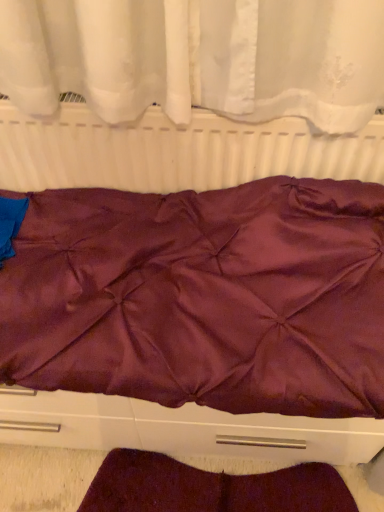
What is the approximate width of matte white radiator at center?

It is 2.42 inches.

At what (x,y) coordinates should I click in order to perform the action: click on satin purple bedspread at center. Please return your answer as a coordinate pair (x, y). The image size is (384, 512). Looking at the image, I should click on (199, 321).

Is matte white radiator at center far away from burgundy satin blanket at lower center?

matte white radiator at center is near burgundy satin blanket at lower center, not far away.

Which is behind, matte white radiator at center or burgundy satin blanket at lower center?

burgundy satin blanket at lower center is behind.

Is matte white radiator at center shorter than burgundy satin blanket at lower center?

No, matte white radiator at center is not shorter than burgundy satin blanket at lower center.

Is point (281, 162) in front of point (185, 506)?

Yes, it is.

From the image's perspective, is satin purple bedspread at center above or below matte white radiator at center?

satin purple bedspread at center is below matte white radiator at center.

Is satin purple bedspread at center oriented towards matte white radiator at center?

No.

Which object is thinner, satin purple bedspread at center or matte white radiator at center?

With smaller width is matte white radiator at center.

Considering the relative positions of satin purple bedspread at center and matte white radiator at center in the image provided, is satin purple bedspread at center to the left of matte white radiator at center from the viewer's perspective?

Yes.

Considering the sizes of objects matte white radiator at center and satin purple bedspread at center in the image provided, who is wider, matte white radiator at center or satin purple bedspread at center?

With larger width is satin purple bedspread at center.

Is matte white radiator at center turned away from satin purple bedspread at center?

matte white radiator at center is not turned away from satin purple bedspread at center.

Looking at this image, which is more to the left, matte white radiator at center or satin purple bedspread at center?

From the viewer's perspective, satin purple bedspread at center appears more on the left side.

Between matte white radiator at center and satin purple bedspread at center, which one has more height?

With more height is satin purple bedspread at center.

Which is in front, satin purple bedspread at center or burgundy satin blanket at lower center?

satin purple bedspread at center is more forward.

Would you say satin purple bedspread at center is outside burgundy satin blanket at lower center?

That's correct, satin purple bedspread at center is outside of burgundy satin blanket at lower center.

From the image's perspective, is satin purple bedspread at center under burgundy satin blanket at lower center?

No, from the image's perspective, satin purple bedspread at center is not beneath burgundy satin blanket at lower center.

At what (x,y) coordinates should I click in order to perform the action: click on blanket below the satin purple bedspread at center (from the image's perspective). Please return your answer as a coordinate pair (x, y). Image resolution: width=384 pixels, height=512 pixels. Looking at the image, I should click on (210, 487).

Which object is more forward, burgundy satin blanket at lower center or satin purple bedspread at center?

Positioned in front is satin purple bedspread at center.

Is burgundy satin blanket at lower center at the right side of satin purple bedspread at center?

Yes, burgundy satin blanket at lower center is to the right of satin purple bedspread at center.

Considering the positions of objects burgundy satin blanket at lower center and matte white radiator at center in the image provided, who is behind, burgundy satin blanket at lower center or matte white radiator at center?

Positioned behind is burgundy satin blanket at lower center.

What's the angular difference between burgundy satin blanket at lower center and matte white radiator at center's facing directions?

The angle between the facing direction of burgundy satin blanket at lower center and the facing direction of matte white radiator at center is 0.209 degrees.

Can you confirm if burgundy satin blanket at lower center is taller than matte white radiator at center?

No, burgundy satin blanket at lower center is not taller than matte white radiator at center.

From a real-world perspective, is burgundy satin blanket at lower center physically located above or below matte white radiator at center?

burgundy satin blanket at lower center is below matte white radiator at center.

Where is `blanket located underneath the matte white radiator at center (from a real-world perspective)`? blanket located underneath the matte white radiator at center (from a real-world perspective) is located at coordinates (210, 487).

The width and height of the screenshot is (384, 512). What are the coordinates of `radiator behind the satin purple bedspread at center` in the screenshot? It's located at (175, 151).

When comparing their distances from satin purple bedspread at center, does burgundy satin blanket at lower center or matte white radiator at center seem further?

Among the two, burgundy satin blanket at lower center is located further to satin purple bedspread at center.

From the image, which object appears to be farther from matte white radiator at center, burgundy satin blanket at lower center or satin purple bedspread at center?

burgundy satin blanket at lower center.

Consider the image. Based on their spatial positions, is matte white radiator at center or satin purple bedspread at center further from burgundy satin blanket at lower center?

matte white radiator at center is further to burgundy satin blanket at lower center.

From the image, which object appears to be nearer to burgundy satin blanket at lower center, satin purple bedspread at center or matte white radiator at center?

Based on the image, satin purple bedspread at center appears to be nearer to burgundy satin blanket at lower center.

When comparing their distances from matte white radiator at center, does satin purple bedspread at center or burgundy satin blanket at lower center seem closer?

satin purple bedspread at center is closer to matte white radiator at center.

Based on the photo, when comparing their distances from satin purple bedspread at center, does matte white radiator at center or burgundy satin blanket at lower center seem closer?

Based on the image, matte white radiator at center appears to be nearer to satin purple bedspread at center.

At what (x,y) coordinates should I click in order to perform the action: click on furniture between matte white radiator at center and burgundy satin blanket at lower center vertically. Please return your answer as a coordinate pair (x, y). Looking at the image, I should click on (199, 321).